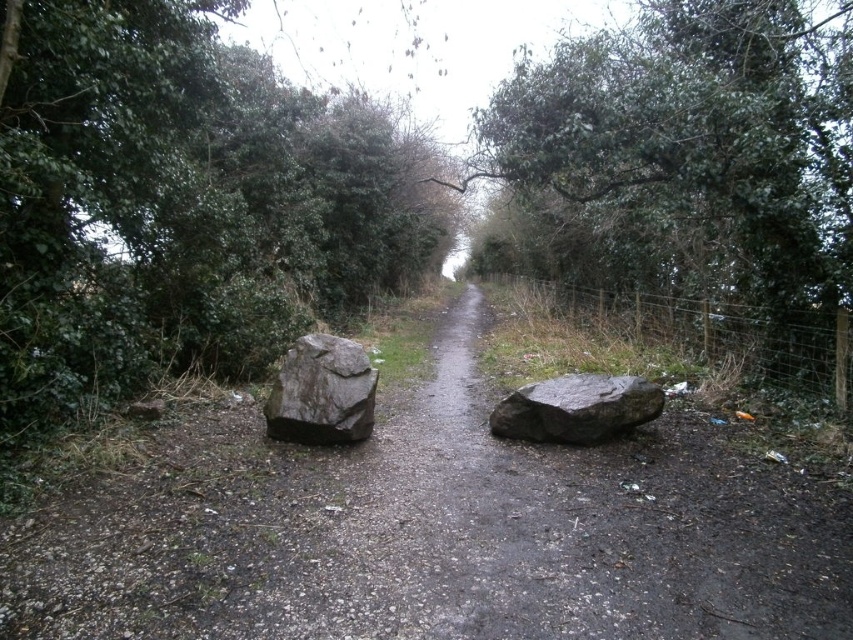
Question: Is green leafy tree at left above gray rough rock at center?

Choices:
 (A) yes
 (B) no

Answer: (A)

Question: Where is green leafy tree at left located in relation to green leafy tree at center in the image?

Choices:
 (A) left
 (B) right

Answer: (A)

Question: Which of the following is the closest to the observer?

Choices:
 (A) (334, 422)
 (B) (677, 305)

Answer: (A)

Question: Does green leafy tree at left appear on the right side of green leafy tree at center?

Choices:
 (A) no
 (B) yes

Answer: (A)

Question: Which point is farther to the camera?

Choices:
 (A) (0, 28)
 (B) (349, 355)
 (C) (625, 417)
 (D) (584, 256)

Answer: (D)

Question: Which of the following is the farthest from the observer?

Choices:
 (A) green leafy tree at center
 (B) green leafy tree at left
 (C) gray rough rock at center
 (D) gray rough boulder at center

Answer: (D)